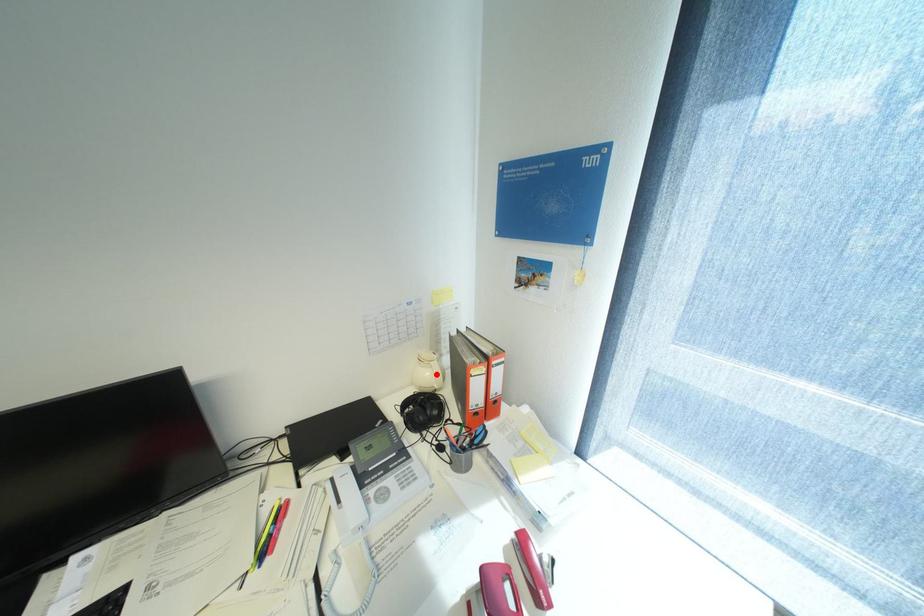
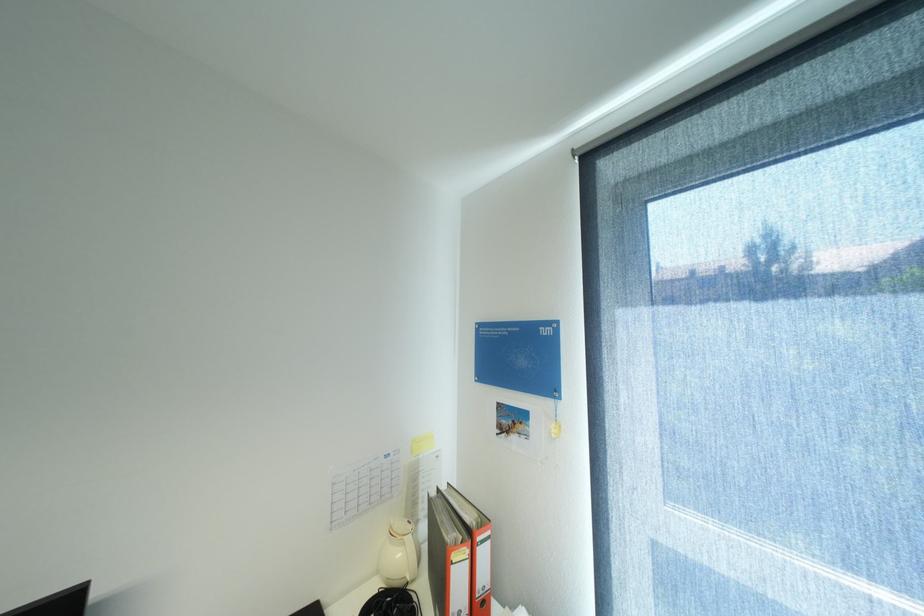
The point at the highlighted location is marked in the first image. Where is the corresponding point in the second image?

(407, 554)